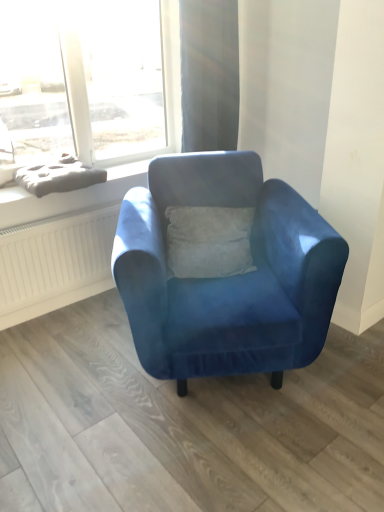
Question: From a real-world perspective, is velvet blue armchair at center positioned under gray fabric cushion at upper left based on gravity?

Choices:
 (A) yes
 (B) no

Answer: (A)

Question: Considering the relative positions of velvet blue armchair at center and gray fabric cushion at upper left in the image provided, is velvet blue armchair at center to the left of gray fabric cushion at upper left from the viewer's perspective?

Choices:
 (A) no
 (B) yes

Answer: (A)

Question: Does velvet blue armchair at center come in front of gray fabric cushion at upper left?

Choices:
 (A) yes
 (B) no

Answer: (A)

Question: Does velvet blue armchair at center turn towards gray fabric cushion at upper left?

Choices:
 (A) no
 (B) yes

Answer: (A)

Question: Is velvet blue armchair at center to the right of gray fabric cushion at upper left from the viewer's perspective?

Choices:
 (A) yes
 (B) no

Answer: (A)

Question: Is gray fabric cushion at upper left inside velvet blue armchair at center?

Choices:
 (A) no
 (B) yes

Answer: (A)

Question: Is matte gray cushion at upper left not inside satin beige curtain at upper center?

Choices:
 (A) no
 (B) yes

Answer: (B)

Question: From a real-world perspective, does matte gray cushion at upper left sit lower than satin beige curtain at upper center?

Choices:
 (A) yes
 (B) no

Answer: (A)

Question: From the image's perspective, does matte gray cushion at upper left appear higher than satin beige curtain at upper center?

Choices:
 (A) no
 (B) yes

Answer: (A)

Question: Is matte gray cushion at upper left in front of satin beige curtain at upper center?

Choices:
 (A) no
 (B) yes

Answer: (B)

Question: Considering the relative positions of matte gray cushion at upper left and satin beige curtain at upper center in the image provided, is matte gray cushion at upper left to the right of satin beige curtain at upper center from the viewer's perspective?

Choices:
 (A) no
 (B) yes

Answer: (A)

Question: Is matte gray cushion at upper left oriented away from satin beige curtain at upper center?

Choices:
 (A) no
 (B) yes

Answer: (A)

Question: Can you confirm if satin beige curtain at upper center is positioned to the left of matte gray cushion at upper left?

Choices:
 (A) yes
 (B) no

Answer: (B)